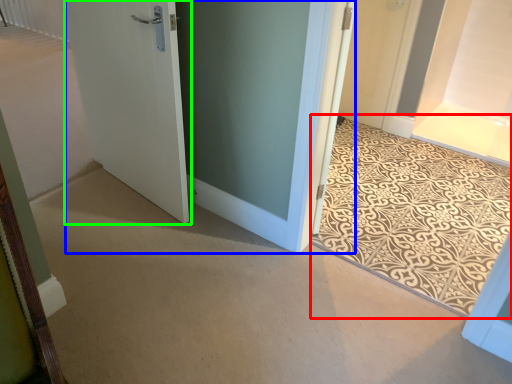
Question: Which object is positioned closest to doormat (highlighted by a red box)? Select from door (highlighted by a blue box) and door (highlighted by a green box).

Choices:
 (A) door
 (B) door

Answer: (A)